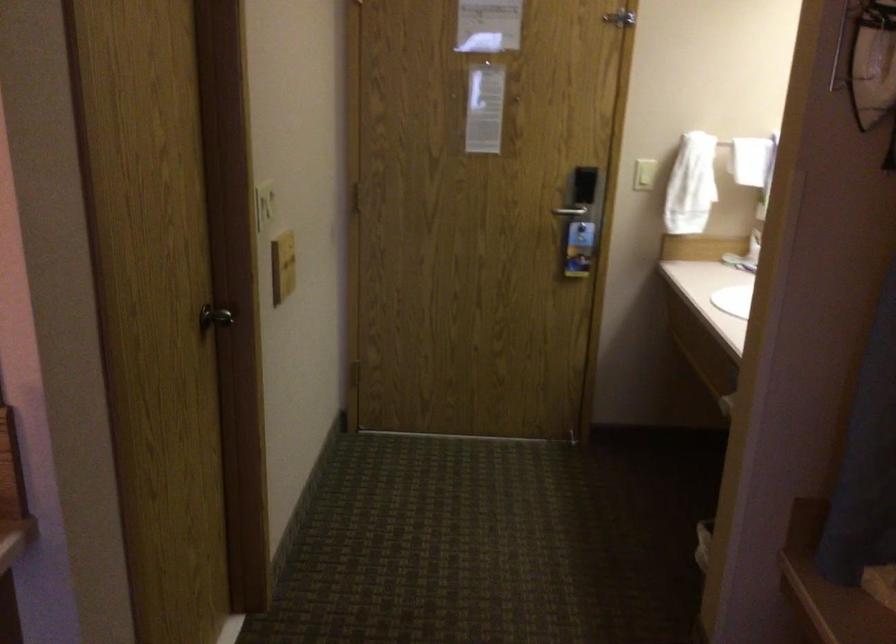
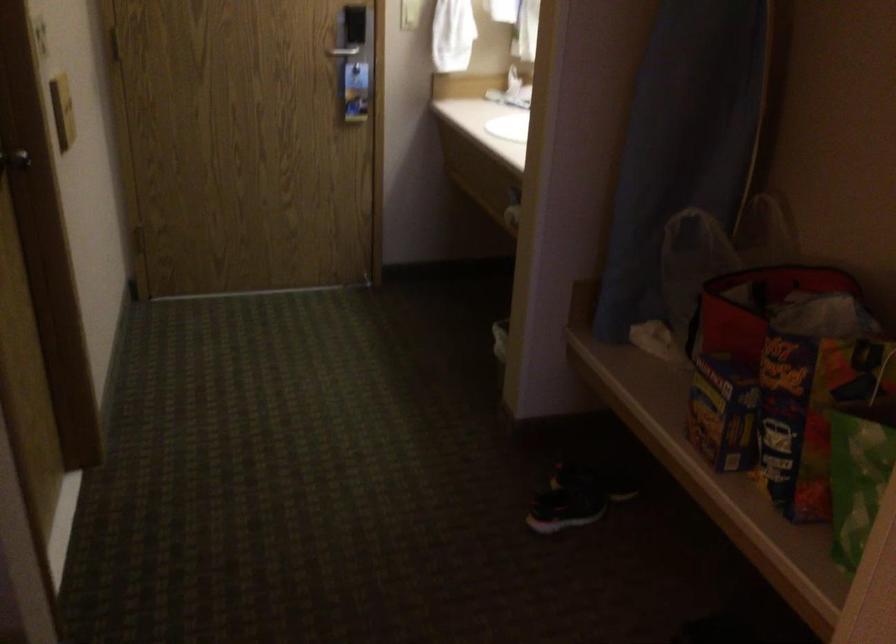
Question: Based on the continuous images, in which direction is the camera rotating? Reply with the corresponding letter.

Choices:
 (A) Left
 (B) Right
 (C) Up
 (D) Down

Answer: (B)